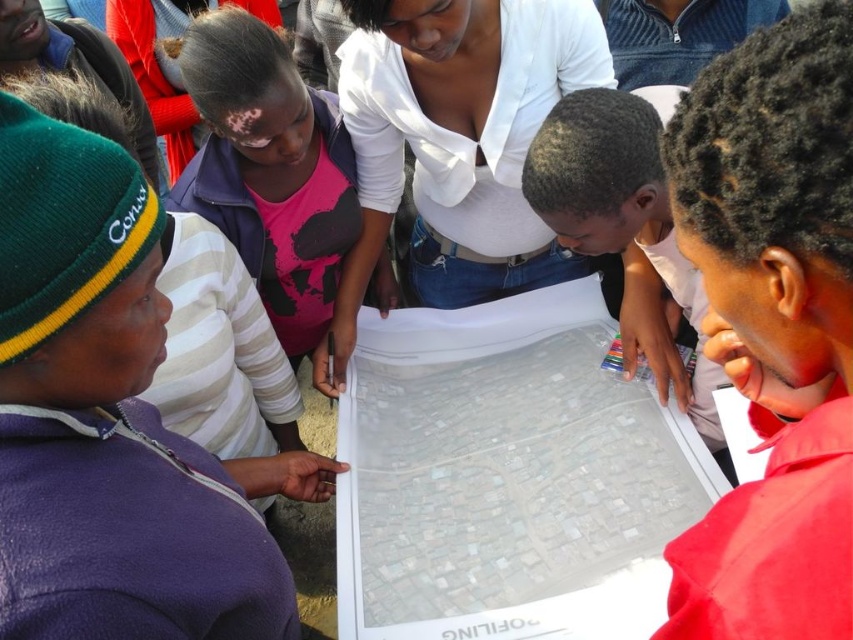
Who is higher up, white matte shirt at center or pink matte shirt at upper center?

white matte shirt at center is above.

What do you see at coordinates (456, 138) in the screenshot? I see `white matte shirt at center` at bounding box center [456, 138].

Find the location of a particular element. This screenshot has width=853, height=640. white matte shirt at center is located at coordinates (456, 138).

Measure the distance between point (807, 566) and camera.

Point (807, 566) and camera are 25.00 inches apart from each other.

Can you confirm if smooth red shirt at lower right is bigger than pink matte shirt at upper center?

No, smooth red shirt at lower right is not bigger than pink matte shirt at upper center.

Find the location of a particular element. The image size is (853, 640). smooth red shirt at lower right is located at coordinates (773, 324).

Can you confirm if smooth red shirt at lower right is positioned above white matte shirt at center?

Actually, smooth red shirt at lower right is below white matte shirt at center.

Based on the photo, between smooth red shirt at lower right and white matte shirt at center, which one is positioned higher?

white matte shirt at center

Identify the location of smooth red shirt at lower right. This screenshot has height=640, width=853. (773, 324).

Locate an element on the screen. The width and height of the screenshot is (853, 640). smooth red shirt at lower right is located at coordinates tap(773, 324).